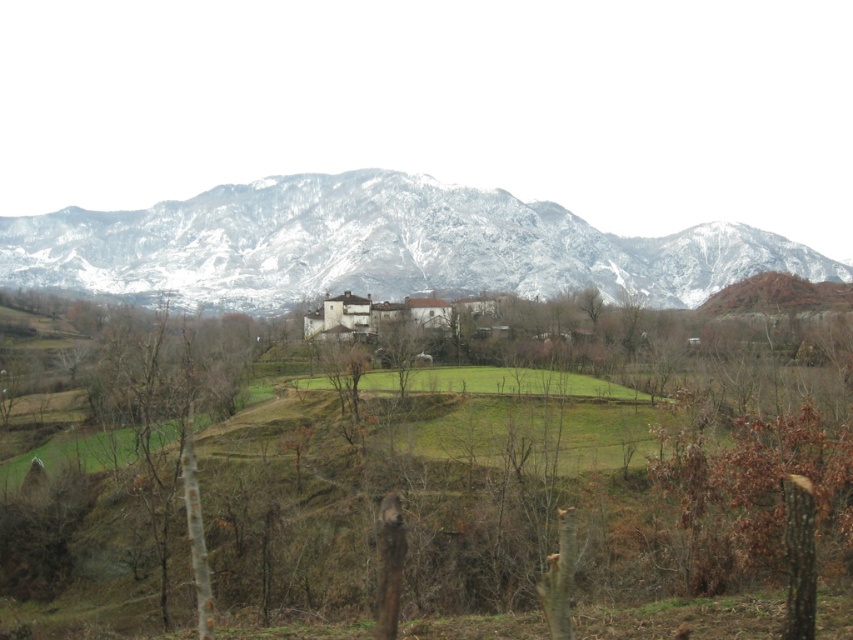
Which is more to the left, brown rough tree at center or snowy rock mountain range at upper center?

snowy rock mountain range at upper center

Between brown rough tree at center and snowy rock mountain range at upper center, which one has less height?

Standing shorter between the two is brown rough tree at center.

Between point (506, 332) and point (175, 266), which one is positioned in front?

Point (506, 332) is in front.

Find the location of a particular element. brown rough tree at center is located at coordinates (412, 461).